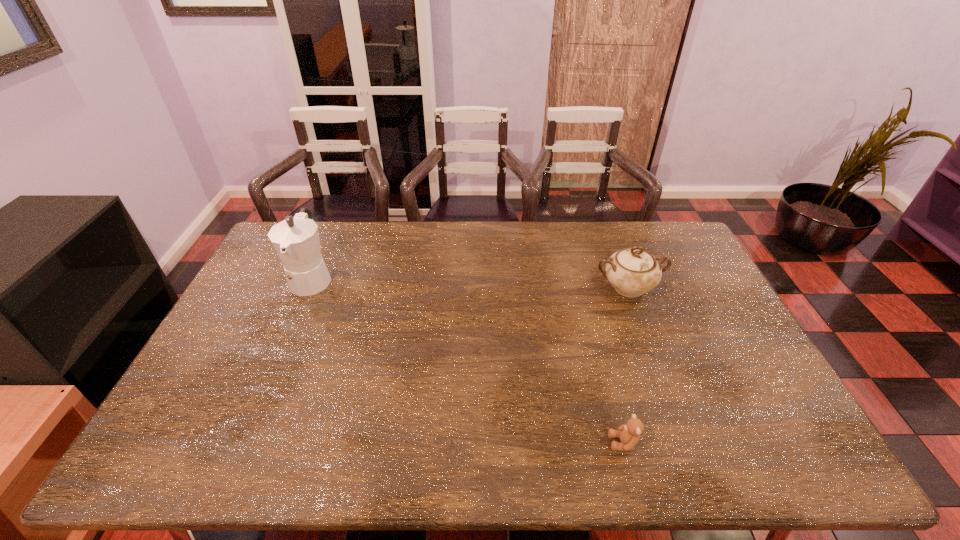
Where is `unoccupied area between the rightmost object and the coffeepot`? This screenshot has width=960, height=540. unoccupied area between the rightmost object and the coffeepot is located at coordinates (470, 283).

You are a GUI agent. You are given a task and a screenshot of the screen. Output one action in this format:
    pyautogui.click(x=<x>, y=<y>)
    Task: Click on the second closest object relative to the coffeepot
    The width and height of the screenshot is (960, 540).
    Given the screenshot: What is the action you would take?
    (629, 433)

Where is `the closest object to the nearest object`? The width and height of the screenshot is (960, 540). the closest object to the nearest object is located at coordinates (632, 272).

At what (x,y) coordinates should I click in order to perform the action: click on free location that satisfies the following two spatial constraints: 1. on the front side of the chinaware; 2. on the face of the second object from right to left. Please return your answer as a coordinate pair (x, y). The height and width of the screenshot is (540, 960). Looking at the image, I should click on pyautogui.click(x=686, y=443).

Where is `vacant point that satisfies the following two spatial constraints: 1. on the front side of the rightmost object; 2. on the face of the second object from left to right`? vacant point that satisfies the following two spatial constraints: 1. on the front side of the rightmost object; 2. on the face of the second object from left to right is located at coordinates (686, 443).